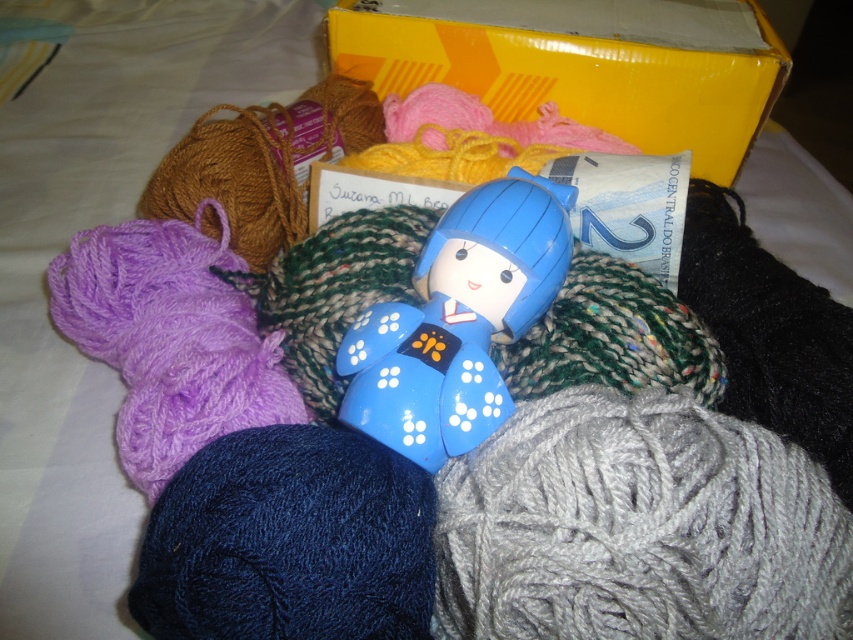
You are organizing a craft fair and need to display the yellow cardboard box at upper center and the blue glossy doll at center on a shelf. If the shelf has limited width, which item should you place first to ensure both can fit without overlapping?

The yellow cardboard box at upper center might be wider than blue glossy doll at center, so place the doll first to accommodate the wider box afterward.

You are standing 30 inches away from the yellow cardboard box at upper center. Can you reach it without moving your feet?

The yellow cardboard box at upper center is 32.50 inches away from the camera, so you are 30 inches away from it. Since the distance between you and the box is 2.5 inches, you can reach it without moving your feet.